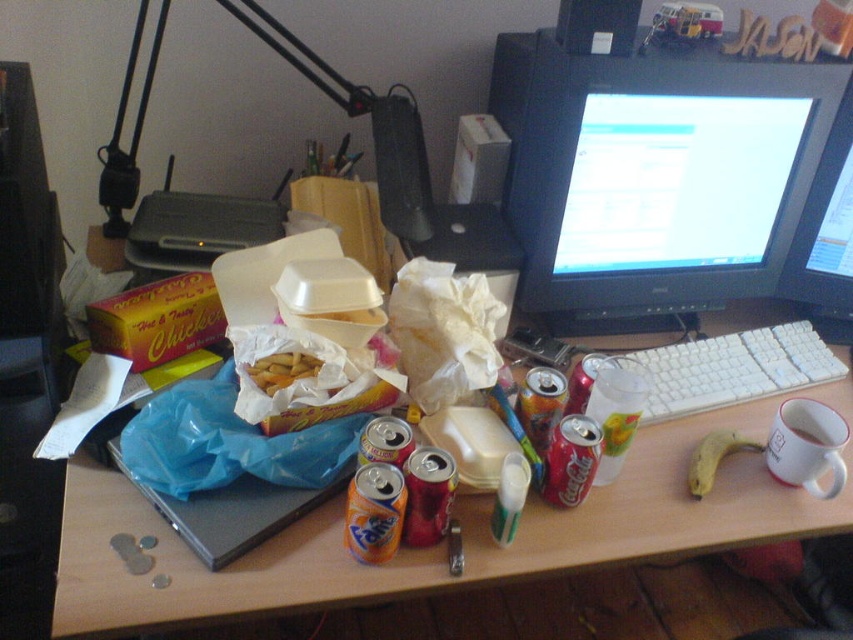
Question: Can you confirm if black plastic lamp at upper left is positioned to the right of yellow crispy french fries at center?

Choices:
 (A) yes
 (B) no

Answer: (B)

Question: Which of these objects is positioned farthest from the black plastic lamp at upper left?

Choices:
 (A) yellow crispy french fries at center
 (B) wooden desk at center

Answer: (B)

Question: Which of the following is the farthest from the observer?

Choices:
 (A) (692, 387)
 (B) (730, 445)

Answer: (A)

Question: Can you confirm if black plastic lamp at upper left is positioned above black glossy monitor at center?

Choices:
 (A) yes
 (B) no

Answer: (A)

Question: Is black plastic lamp at upper left further to camera compared to black glossy monitor at center?

Choices:
 (A) yes
 (B) no

Answer: (B)

Question: Which object is closer to the camera taking this photo?

Choices:
 (A) black plastic monitor at upper right
 (B) wooden desk at center

Answer: (B)